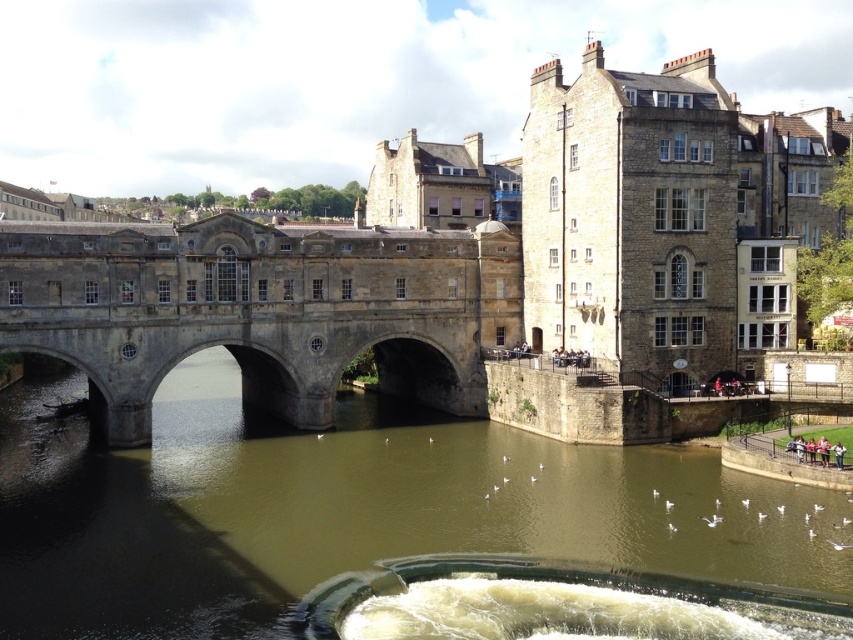
You are a construction worker tasked with placing a 12 meter long safety barrier between the brown stone river at center and the stone bridge at center. Can you fit the barrier between them?

The brown stone river at center and the stone bridge at center are 11.91 meters apart, so the 12 meter long safety barrier cannot fit between them as it is slightly longer than the available space.